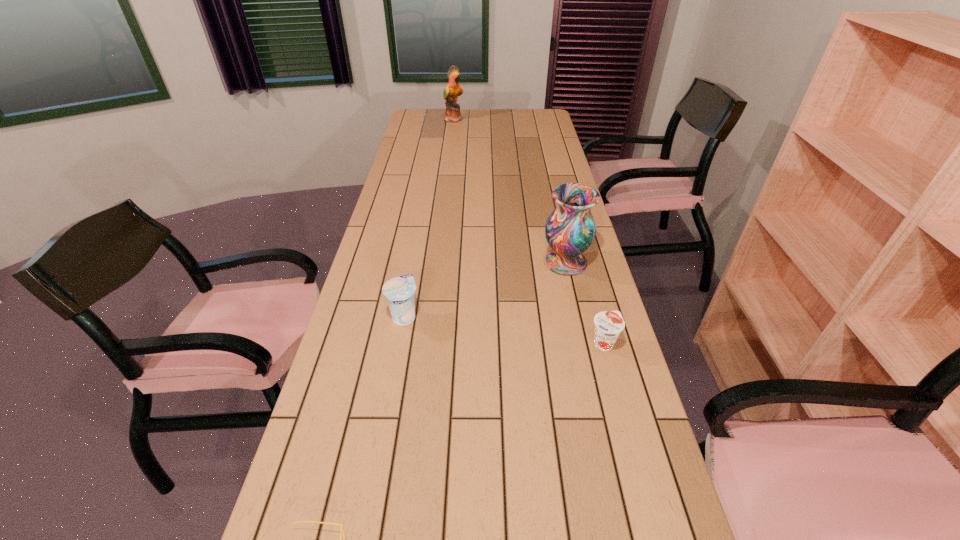
The height and width of the screenshot is (540, 960). Identify the location of the farthest object. (453, 89).

Image resolution: width=960 pixels, height=540 pixels. Identify the location of the fourth nearest object. (570, 229).

The width and height of the screenshot is (960, 540). I want to click on the taller yogurt, so click(400, 291).

Identify the location of the farther yogurt. (400, 291).

Locate an element on the screen. This screenshot has height=540, width=960. the shorter yogurt is located at coordinates (608, 324).

At what (x,y) coordinates should I click in order to perform the action: click on the fourth farthest object. Please return your answer as a coordinate pair (x, y). The height and width of the screenshot is (540, 960). Looking at the image, I should click on (608, 324).

Locate an element on the screen. The image size is (960, 540). vacant position located 0.050m on the front-facing side of the parrot is located at coordinates (473, 119).

In order to click on vacant area located on the front of the vase in this screenshot , I will do `click(584, 343)`.

In order to click on vacant area situated 0.340m on the front of the farther yogurt in this screenshot , I will do `click(380, 450)`.

Identify the location of free region located 0.330m on the front of the right yogurt. (643, 487).